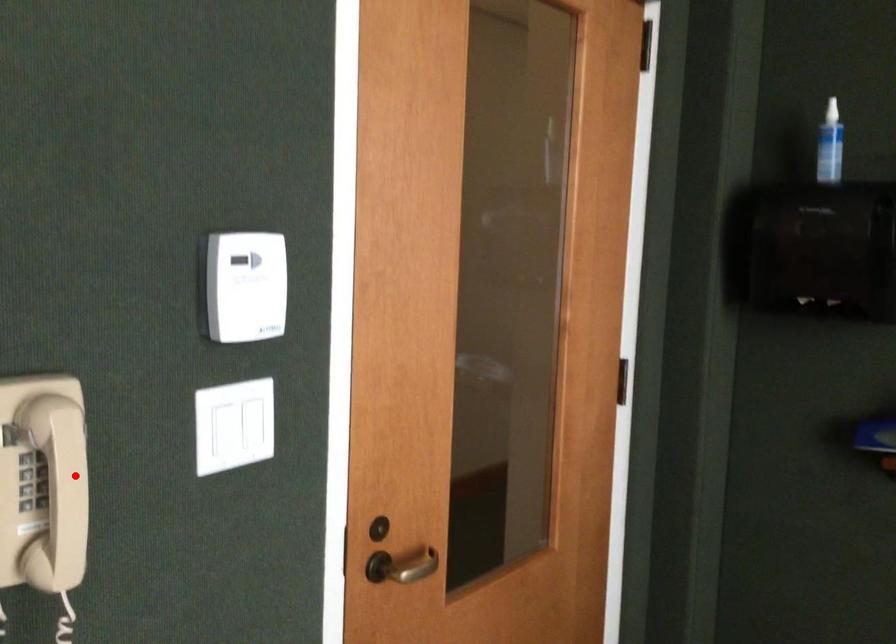
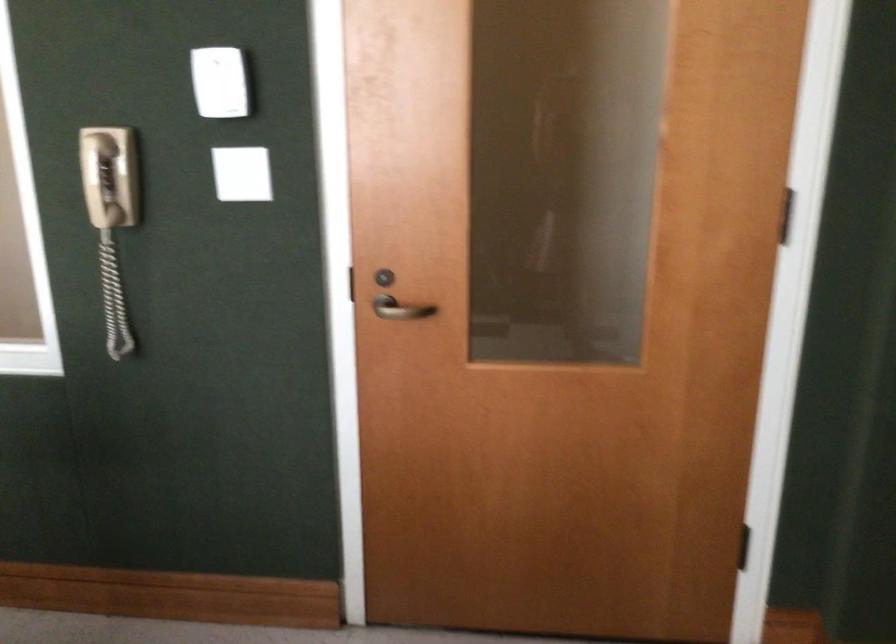
Question: I am providing you with two images of the same scene from different viewpoints. A red point is shown in image1. For the corresponding object point in image2, is it positioned nearer or farther from the camera?

Choices:
 (A) Nearer
 (B) Farther

Answer: (B)